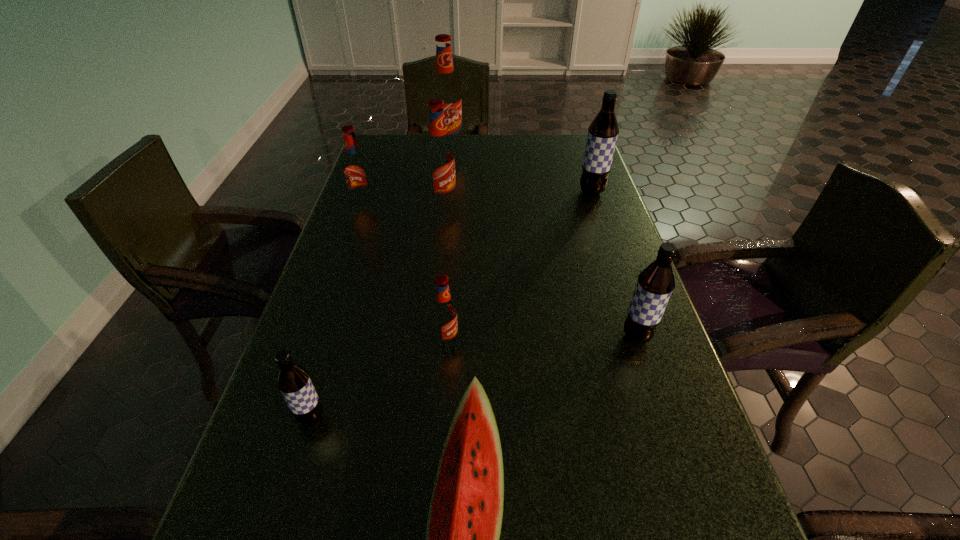
Image resolution: width=960 pixels, height=540 pixels. What are the coordinates of `free space at the far left corner` in the screenshot? It's located at (367, 160).

Where is `vacant area that lies between the tallest root beer and the nearest red root beer`? Image resolution: width=960 pixels, height=540 pixels. vacant area that lies between the tallest root beer and the nearest red root beer is located at coordinates (447, 245).

The image size is (960, 540). I want to click on vacant area between the leftmost red root beer and the second biggest brown root beer, so click(x=500, y=271).

Where is `free spot between the farthest object and the leftmost brown root beer`? This screenshot has width=960, height=540. free spot between the farthest object and the leftmost brown root beer is located at coordinates (380, 283).

Where is `free space that is in between the farthest brown root beer and the second farthest brown root beer`? This screenshot has height=540, width=960. free space that is in between the farthest brown root beer and the second farthest brown root beer is located at coordinates (614, 264).

Identify the location of free space that is in between the second biggest brown root beer and the leftmost red root beer. (500, 271).

Image resolution: width=960 pixels, height=540 pixels. What are the coordinates of `free space between the third smallest red root beer and the leftmost brown root beer` in the screenshot? It's located at (377, 310).

The width and height of the screenshot is (960, 540). I want to click on vacant point located between the tallest object and the biggest brown root beer, so point(520,170).

Select which object appears as the sixth closest to the watermelon. Please provide its 2D coordinates. Your answer should be formatted as a tuple, i.e. [(x, y)], where the tuple contains the x and y coordinates of a point satisfying the conditions above.

[(603, 131)]

What are the coordinates of `object identified as the fifth closest to the nearest root beer` in the screenshot? It's located at (439, 157).